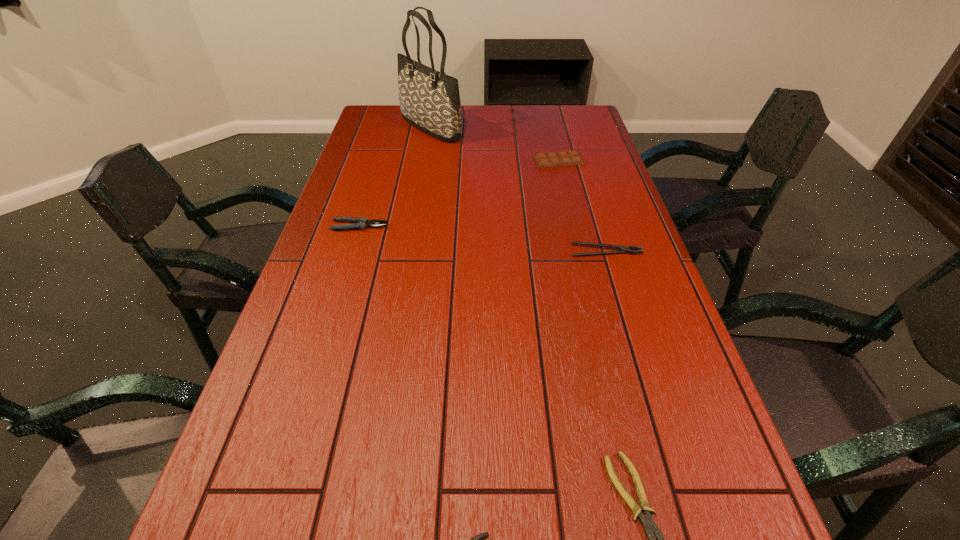
Identify the location of tote bag. (429, 100).

This screenshot has height=540, width=960. What are the coordinates of `the tallest object` in the screenshot? It's located at (429, 100).

You are a GUI agent. You are given a task and a screenshot of the screen. Output one action in this format:
    pyautogui.click(x=<x>, y=<y>)
    Task: Click on the fifth shortest object
    This screenshot has height=540, width=960.
    Given the screenshot: What is the action you would take?
    pyautogui.click(x=359, y=223)

Where is `the fourth nearest object`? This screenshot has height=540, width=960. the fourth nearest object is located at coordinates (359, 223).

Find the location of a particular element. the third nearest object is located at coordinates (623, 249).

Locate an element on the screen. The height and width of the screenshot is (540, 960). chocolate bar is located at coordinates (564, 158).

Where is `vacant space located on the left of the tote bag`? This screenshot has width=960, height=540. vacant space located on the left of the tote bag is located at coordinates (377, 127).

Where is `vacant space located at the gripping part of the farthest pliers`? vacant space located at the gripping part of the farthest pliers is located at coordinates (442, 226).

Identify the location of free space located on the front of the third nearest object. (615, 282).

The width and height of the screenshot is (960, 540). I want to click on blank area located on the back of the chocolate bar, so click(547, 113).